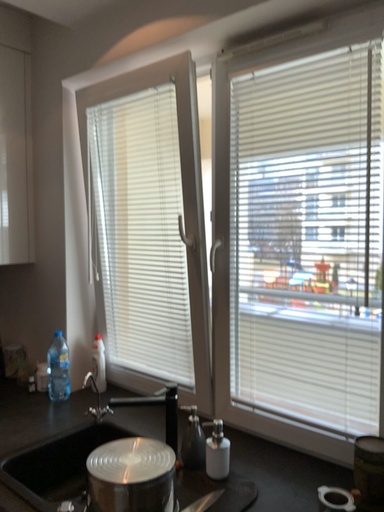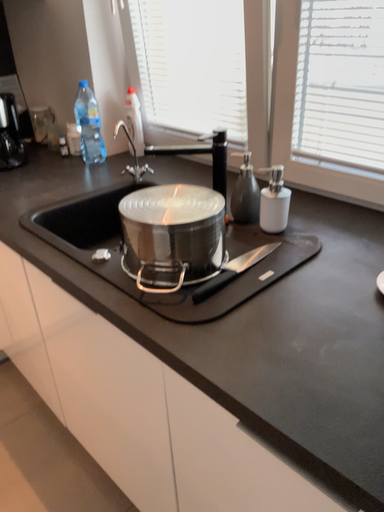
Question: How did the camera likely rotate when shooting the video?

Choices:
 (A) rotated upward
 (B) rotated downward

Answer: (B)